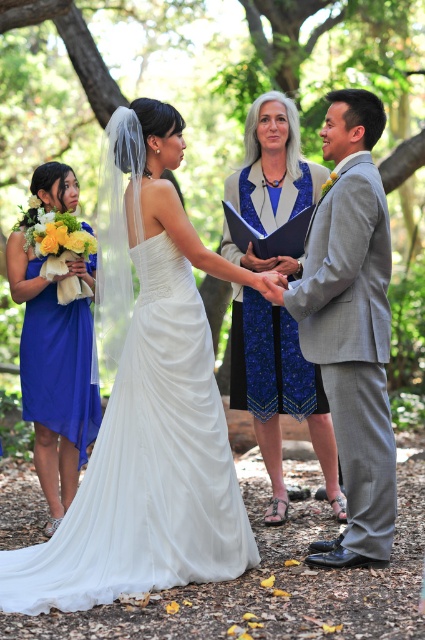
Question: Where is white satin dress at center located in relation to royal blue satin dress at lower left in the image?

Choices:
 (A) above
 (B) below

Answer: (B)

Question: Among these points, which one is nearest to the camera?

Choices:
 (A) (42, 184)
 (B) (261, 186)
 (C) (367, 516)
 (D) (17, 563)

Answer: (C)

Question: Which object is the closest to the white satin dress at center?

Choices:
 (A) royal blue satin dress at lower left
 (B) blue textured dress at center
 (C) gray textured suit at right

Answer: (C)

Question: Is gray textured suit at right to the right of blue textured dress at center from the viewer's perspective?

Choices:
 (A) yes
 (B) no

Answer: (A)

Question: Can you confirm if white satin dress at center is wider than royal blue satin dress at lower left?

Choices:
 (A) yes
 (B) no

Answer: (A)

Question: Which of these objects is positioned farthest from the white satin dress at center?

Choices:
 (A) gray textured suit at right
 (B) royal blue satin dress at lower left

Answer: (B)